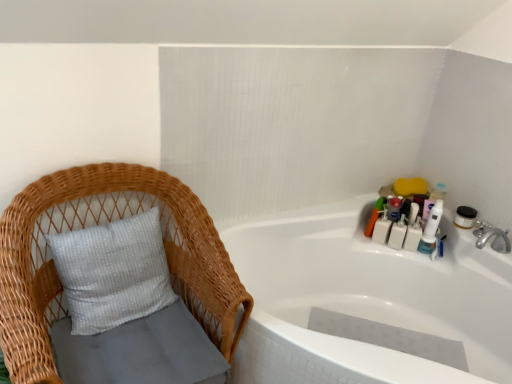
Question: Considering the relative positions of woven wood chair at left and matte plastic toothbrush at upper right, the sixth toiletry when ordered from right to left, in the image provided, is woven wood chair at left to the left or to the right of matte plastic toothbrush at upper right, the sixth toiletry when ordered from right to left,?

Choices:
 (A) left
 (B) right

Answer: (A)

Question: Is woven wood chair at left spatially inside matte plastic toothbrush at upper right, the sixth toiletry when ordered from right to left, or outside of it?

Choices:
 (A) inside
 (B) outside

Answer: (B)

Question: Which of these objects is positioned farthest from the white glossy bathtub at upper right?

Choices:
 (A) matte plastic toothbrush at upper right, the sixth toiletry when ordered from right to left
 (B) white plastic bottles at upper right, the fifth toiletry when ordered from right to left
 (C) white plastic bottles at upper right, positioned as the 3th toiletry in left-to-right order
 (D) white plastic toothbrush at upper right, which is counted as the first toiletry, starting from the right
 (E) woven wood chair at left

Answer: (E)

Question: Which object is positioned closest to the matte plastic toothbrush at upper right, which is the first toiletry from left to right?

Choices:
 (A) white plastic bottles at upper right, the fourth toiletry in the right-to-left sequence
 (B) white plastic toothbrush at upper right, acting as the 2th toiletry starting from the right
 (C) white plastic bottles at upper right, the fifth toiletry when ordered from right to left
 (D) translucent plastic bottle at upper right, marked as the fourth toiletry in a left-to-right arrangement
 (E) white plastic toothbrush at upper right, which is the 6th toiletry from left to right

Answer: (C)